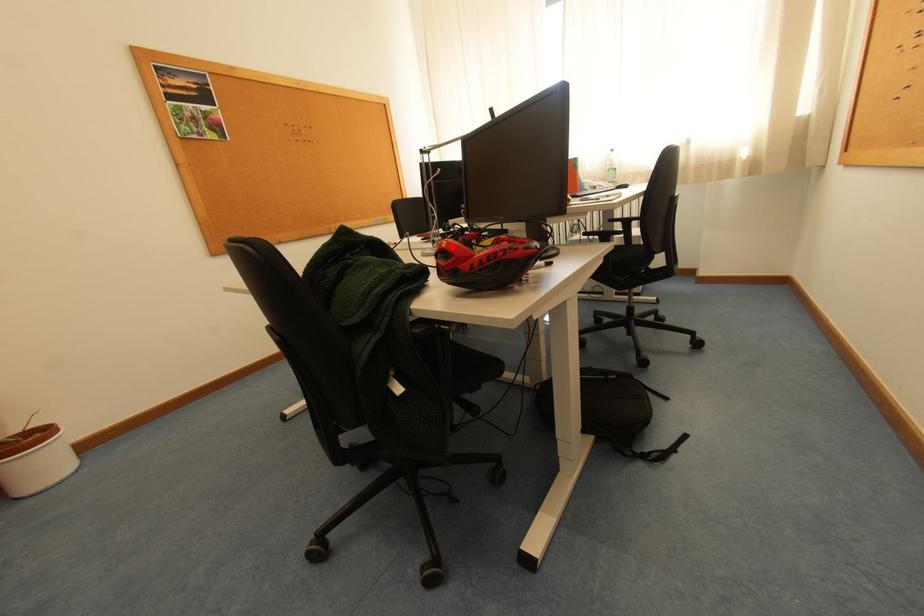
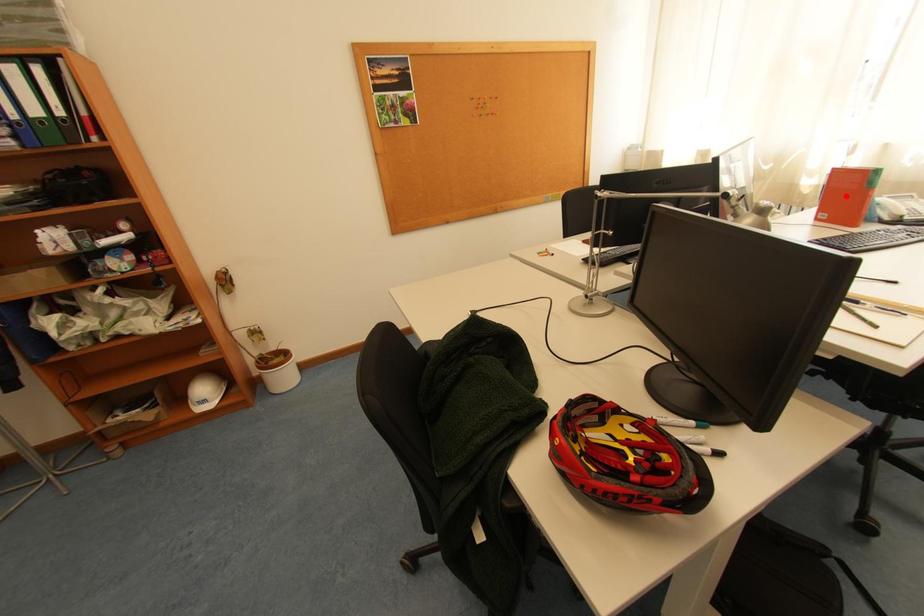
I am providing you with two images of the same scene from different viewpoints. A red point is marked on the first image and another point is marked on the second image. Are the points marked in image1 and image2 representing the same 3D position?

No